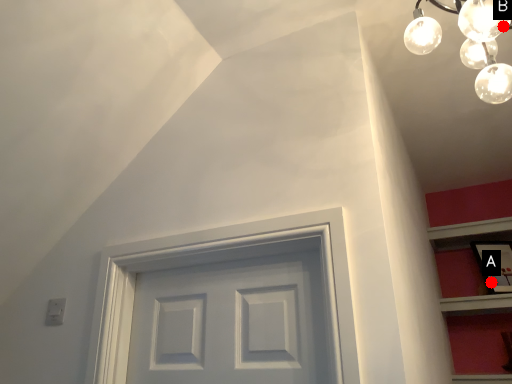
Question: Two points are circled on the image, labeled by A and B beside each circle. Which point appears closest to the camera in this image?

Choices:
 (A) A is closer
 (B) B is closer

Answer: (B)